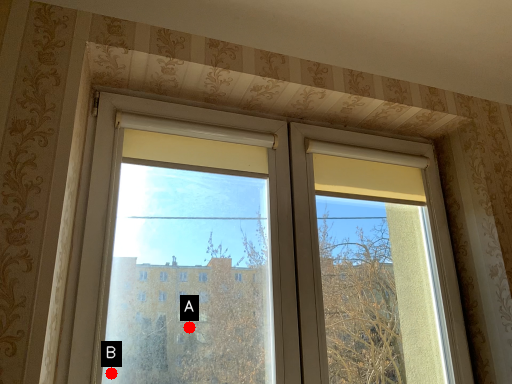
Question: Two points are circled on the image, labeled by A and B beside each circle. Among these points, which one is farthest from the camera?

Choices:
 (A) A is further
 (B) B is further

Answer: (A)